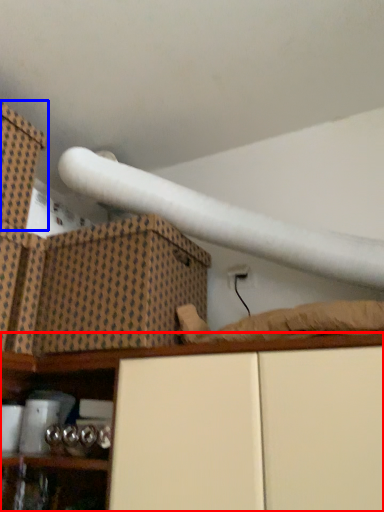
Question: Which of the following is the farthest to the observer, shelf (highlighted by a red box) or box (highlighted by a blue box)?

Choices:
 (A) shelf
 (B) box

Answer: (B)